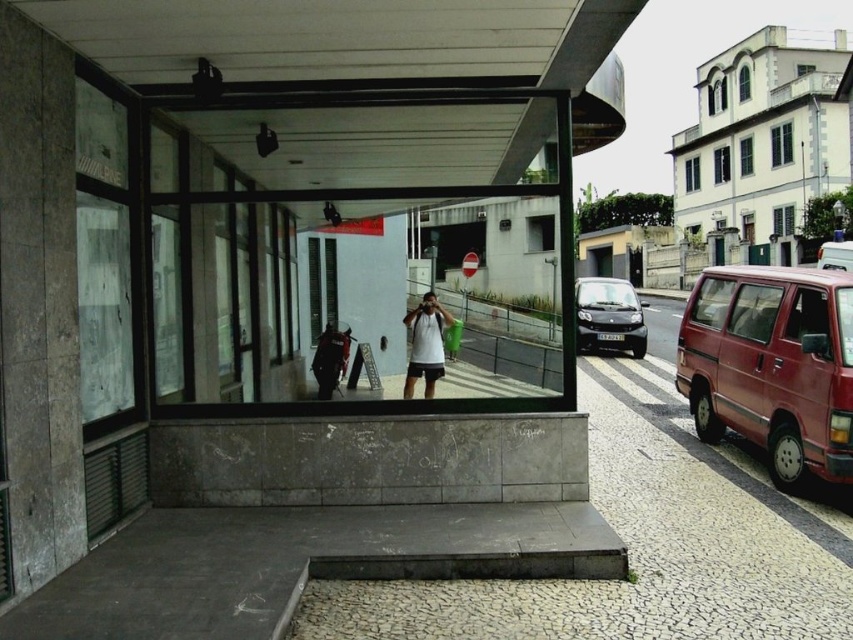
You are standing at the origin point of the image coordinate system. The gray concrete pavement at center is located at coordinates. What are its coordinates?

The gray concrete pavement at center is located at coordinates point (641, 540).

You are standing in the urban street scene looking at the glass structure. There are two points marked on the pavement in front of the structure. The first point is at coordinates point (784, 620) and the second point is at point (821, 244). Which point is closer to you?

Point (784, 620) is closer to the camera than point (821, 244).